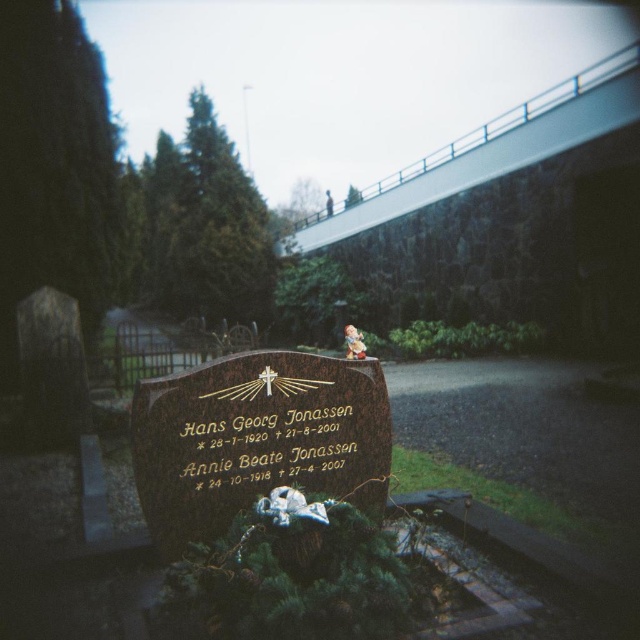
You are standing at the entrance of the cemetery and want to take a photo of the white concrete overpass at upper center. Which direction should you face to ensure the overpass is in the center of your photo?

The white concrete overpass at upper center is located at point coordinates, so you should face the direction corresponding to those coordinates to center it in your photo.

You are a photographer trying to capture a clear shot of the matte ceramic figurine at center without the white concrete overpass at upper center blocking it. Based on their heights, can you suggest a way to adjust your camera angle to achieve this?

The white concrete overpass at upper center is taller than the matte ceramic figurine at center. To avoid the overpass blocking the figurine, lower your camera angle so that the figurine is framed below the overpass.